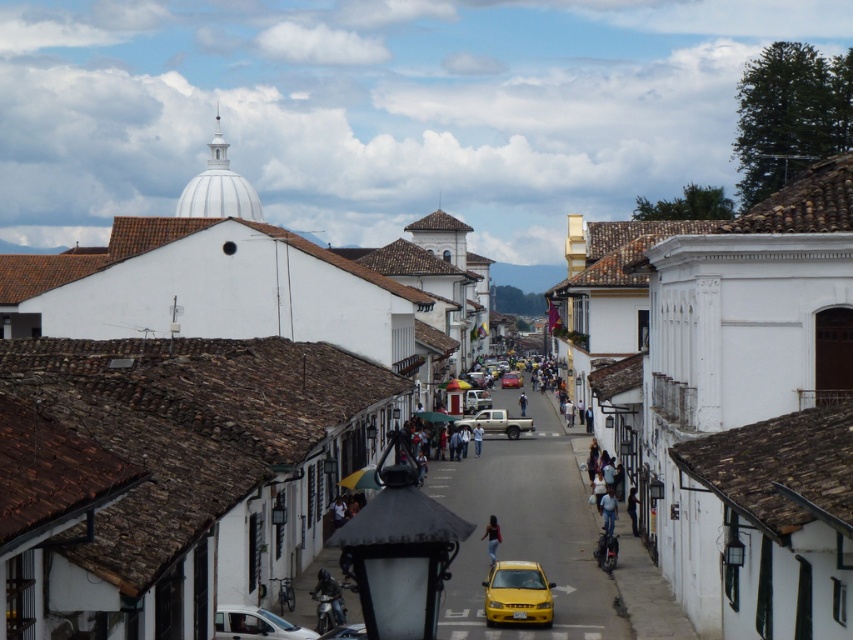
Question: Which of these objects is positioned farthest from the white matte truck at center?

Choices:
 (A) yellow matte taxi at center
 (B) light blue jeans at center-right

Answer: (A)

Question: Which point is farther to the camera?

Choices:
 (A) white matte truck at center
 (B) dark blue jeans at center

Answer: (A)

Question: Can you confirm if yellow matte car at center is positioned to the left of light blue jeans at center?

Choices:
 (A) no
 (B) yes

Answer: (A)

Question: Considering the relative positions of yellow matte taxi at center and yellow matte car at center in the image provided, where is yellow matte taxi at center located with respect to yellow matte car at center?

Choices:
 (A) right
 (B) left

Answer: (B)

Question: Does yellow matte taxi at center appear on the right side of yellow matte car at center?

Choices:
 (A) no
 (B) yes

Answer: (A)

Question: Estimate the real-world distances between objects in this image. Which object is closer to the white matte van at lower left?

Choices:
 (A) yellow matte taxi at center
 (B) light blue jeans at center
 (C) dark blue jeans at center

Answer: (A)